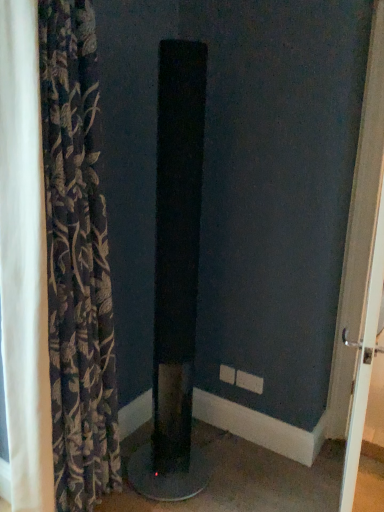
What do you see at coordinates (364, 362) in the screenshot?
I see `white glossy door handle at right` at bounding box center [364, 362].

Where is `white glossy door handle at right`? white glossy door handle at right is located at coordinates (364, 362).

This screenshot has width=384, height=512. What do you see at coordinates (175, 276) in the screenshot?
I see `black matte speaker at center` at bounding box center [175, 276].

In order to click on white glossy door handle at right in this screenshot , I will do (364, 362).

Can you tell me how much black matte speaker at center and dark floral fabric curtain at left differ in facing direction?

The angle between the facing direction of black matte speaker at center and the facing direction of dark floral fabric curtain at left is 8.51e-05 degrees.

Considering the sizes of black matte speaker at center and dark floral fabric curtain at left in the image, is black matte speaker at center wider or thinner than dark floral fabric curtain at left?

Clearly, black matte speaker at center has more width compared to dark floral fabric curtain at left.

Does black matte speaker at center turn towards dark floral fabric curtain at left?

No, black matte speaker at center is not aimed at dark floral fabric curtain at left.

From the picture: Does white glossy door handle at right appear on the right side of black matte speaker at center?

Yes, white glossy door handle at right is to the right of black matte speaker at center.

Is the surface of white glossy door handle at right in direct contact with black matte speaker at center?

white glossy door handle at right is not next to black matte speaker at center, and they're not touching.

Which object is wider, white glossy door handle at right or black matte speaker at center?

black matte speaker at center is wider.

Locate an element on the screen. pillar behind the white glossy door handle at right is located at coordinates (175, 276).

Does white glossy door handle at right turn towards dark floral fabric curtain at left?

No, white glossy door handle at right is not aimed at dark floral fabric curtain at left.

Which of these two, white glossy door handle at right or dark floral fabric curtain at left, is thinner?

With smaller width is white glossy door handle at right.

Between white glossy door handle at right and dark floral fabric curtain at left, which one has smaller size?

white glossy door handle at right is smaller.

Could dark floral fabric curtain at left be considered to be inside white glossy door handle at right?

No, white glossy door handle at right does not contain dark floral fabric curtain at left.

Is black matte speaker at center smaller than white glossy door handle at right?

Actually, black matte speaker at center might be larger than white glossy door handle at right.

Which object is closer to the camera, black matte speaker at center or white glossy door handle at right?

white glossy door handle at right is in front.

Between point (161, 458) and point (361, 360), which one is positioned behind?

The point (161, 458) is behind.

How many degrees apart are the facing directions of black matte speaker at center and white glossy door handle at right?

black matte speaker at center and white glossy door handle at right are facing 11.3 degrees away from each other.

Is dark floral fabric curtain at left shorter than white glossy door handle at right?

No.

How many degrees apart are the facing directions of dark floral fabric curtain at left and white glossy door handle at right?

The angle between the facing direction of dark floral fabric curtain at left and the facing direction of white glossy door handle at right is 11.3 degrees.

Who is bigger, dark floral fabric curtain at left or white glossy door handle at right?

dark floral fabric curtain at left.

Can you confirm if dark floral fabric curtain at left is positioned to the right of white glossy door handle at right?

Incorrect, dark floral fabric curtain at left is not on the right side of white glossy door handle at right.

Consider the image. What's the angular difference between dark floral fabric curtain at left and black matte speaker at center's facing directions?

There is a 8.51e-05-degree angle between the facing directions of dark floral fabric curtain at left and black matte speaker at center.

Which point is more distant from viewer, (71,244) or (185,280)?

The point (185,280) is farther from the camera.

Would you say dark floral fabric curtain at left is a long distance from black matte speaker at center?

They are positioned close to each other.

Consider the image. From a real-world perspective, is dark floral fabric curtain at left positioned above or below black matte speaker at center?

In terms of real-world spatial position, dark floral fabric curtain at left is above black matte speaker at center.

At what (x,y) coordinates should I click in order to perform the action: click on pillar that is below the dark floral fabric curtain at left (from the image's perspective). Please return your answer as a coordinate pair (x, y). This screenshot has width=384, height=512. Looking at the image, I should click on (175, 276).

This screenshot has width=384, height=512. What are the coordinates of `screen door beneath the black matte speaker at center (from a real-world perspective)` in the screenshot? It's located at (364, 362).

From the image, which object appears to be farther from white glossy door handle at right, dark floral fabric curtain at left or black matte speaker at center?

Based on the image, dark floral fabric curtain at left appears to be further to white glossy door handle at right.

Estimate the real-world distances between objects in this image. Which object is closer to dark floral fabric curtain at left, black matte speaker at center or white glossy door handle at right?

black matte speaker at center lies closer to dark floral fabric curtain at left than the other object.

Estimate the real-world distances between objects in this image. Which object is closer to white glossy door handle at right, black matte speaker at center or dark floral fabric curtain at left?

Among the two, black matte speaker at center is located nearer to white glossy door handle at right.

Which object lies nearer to the anchor point black matte speaker at center, white glossy door handle at right or dark floral fabric curtain at left?

dark floral fabric curtain at left lies closer to black matte speaker at center than the other object.

Looking at the image, which one is located further to black matte speaker at center, dark floral fabric curtain at left or white glossy door handle at right?

Based on the image, white glossy door handle at right appears to be further to black matte speaker at center.

Based on their spatial positions, is white glossy door handle at right or black matte speaker at center further from dark floral fabric curtain at left?

The object further to dark floral fabric curtain at left is white glossy door handle at right.

The width and height of the screenshot is (384, 512). What are the coordinates of `pillar situated between dark floral fabric curtain at left and white glossy door handle at right from left to right` in the screenshot? It's located at (175, 276).